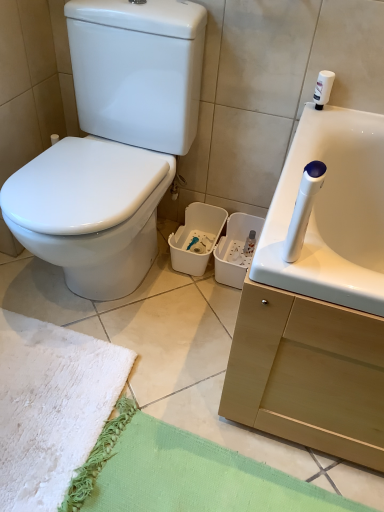
What do you see at coordinates (51, 406) in the screenshot? I see `white fluffy beach towel at lower left` at bounding box center [51, 406].

The height and width of the screenshot is (512, 384). Find the location of `white fluffy beach towel at lower left`. white fluffy beach towel at lower left is located at coordinates (51, 406).

In order to face white glossy toilet at left, should I rotate leftwards or rightwards?

Turn left approximately 11.252 degrees to face it.

Image resolution: width=384 pixels, height=512 pixels. Describe the element at coordinates (113, 144) in the screenshot. I see `white glossy toilet at left` at that location.

Locate an element on the screen. The width and height of the screenshot is (384, 512). white glossy toilet at left is located at coordinates [113, 144].

The height and width of the screenshot is (512, 384). What are the coordinates of `white fluffy beach towel at lower left` in the screenshot? It's located at (51, 406).

Which object is positioned more to the left, white fluffy beach towel at lower left or white glossy toilet at left?

white fluffy beach towel at lower left is more to the left.

From the picture: Considering the relative positions of white fluffy beach towel at lower left and white glossy toilet at left in the image provided, is white fluffy beach towel at lower left in front of white glossy toilet at left?

No, white fluffy beach towel at lower left is behind white glossy toilet at left.

Considering the points (101, 388) and (130, 69), which point is behind, point (101, 388) or point (130, 69)?

The point (130, 69) is farther from the camera.

Based on the photo, from the image's perspective, is white fluffy beach towel at lower left on white glossy toilet at left?

No, from the image's perspective, white fluffy beach towel at lower left is not over white glossy toilet at left.

From a real-world perspective, between white fluffy beach towel at lower left and white glossy toilet at left, who is vertically lower?

white fluffy beach towel at lower left is physically lower.

In the scene shown: Considering the relative sizes of white fluffy beach towel at lower left and white glossy toilet at left in the image provided, is white fluffy beach towel at lower left wider than white glossy toilet at left?

Incorrect, the width of white fluffy beach towel at lower left does not surpass that of white glossy toilet at left.

In the scene shown: Considering the sizes of white fluffy beach towel at lower left and white glossy toilet at left in the image, is white fluffy beach towel at lower left taller or shorter than white glossy toilet at left?

Clearly, white fluffy beach towel at lower left is shorter compared to white glossy toilet at left.

Can you confirm if white fluffy beach towel at lower left is bigger than white glossy toilet at left?

Actually, white fluffy beach towel at lower left might be smaller than white glossy toilet at left.

Can white glossy toilet at left be found inside white fluffy beach towel at lower left?

No, white glossy toilet at left is not surrounded by white fluffy beach towel at lower left.

Based on the photo, is white fluffy beach towel at lower left with white glossy toilet at left?

There is a gap between white fluffy beach towel at lower left and white glossy toilet at left.

Could you tell me if white fluffy beach towel at lower left is turned towards white glossy toilet at left?

No, white fluffy beach towel at lower left is not turned towards white glossy toilet at left.

How distant is white fluffy beach towel at lower left from white glossy toilet at left?

white fluffy beach towel at lower left is 47.10 centimeters from white glossy toilet at left.

At what (x,y) coordinates should I click in order to perform the action: click on beach towel to the left of white glossy toilet at left. Please return your answer as a coordinate pair (x, y). This screenshot has width=384, height=512. Looking at the image, I should click on (51, 406).

Between white glossy toilet at left and white fluffy beach towel at lower left, which one appears on the left side from the viewer's perspective?

white fluffy beach towel at lower left.

Which object is further away from the camera taking this photo, white glossy toilet at left or white fluffy beach towel at lower left?

Positioned behind is white fluffy beach towel at lower left.

Between point (113, 130) and point (66, 362), which one is positioned in front?

Point (66, 362)

From the image's perspective, between white glossy toilet at left and white fluffy beach towel at lower left, who is located below?

white fluffy beach towel at lower left appears lower in the image.

From a real-world perspective, relative to white fluffy beach towel at lower left, is white glossy toilet at left vertically above or below?

From a real-world perspective, white glossy toilet at left is physically above white fluffy beach towel at lower left.

Between white glossy toilet at left and white fluffy beach towel at lower left, which one has larger width?

white glossy toilet at left is wider.

Who is shorter, white glossy toilet at left or white fluffy beach towel at lower left?

With less height is white fluffy beach towel at lower left.

Is white glossy toilet at left bigger than white fluffy beach towel at lower left?

Yes, white glossy toilet at left is bigger than white fluffy beach towel at lower left.

Would you say white glossy toilet at left is inside or outside white fluffy beach towel at lower left?

white glossy toilet at left is spatially situated outside white fluffy beach towel at lower left.

Is white glossy toilet at left placed right next to white fluffy beach towel at lower left?

white glossy toilet at left and white fluffy beach towel at lower left are not in contact.

Does white glossy toilet at left turn towards white fluffy beach towel at lower left?

Yes, white glossy toilet at left is aimed at white fluffy beach towel at lower left.

Can you tell me how much white glossy toilet at left and white fluffy beach towel at lower left differ in facing direction?

The angular difference between white glossy toilet at left and white fluffy beach towel at lower left is 90.5 degrees.

Measure the distance between white glossy toilet at left and white fluffy beach towel at lower left.

A distance of 18.54 inches exists between white glossy toilet at left and white fluffy beach towel at lower left.

Where is `beach towel below the white glossy toilet at left (from the image's perspective)`? beach towel below the white glossy toilet at left (from the image's perspective) is located at coordinates (51, 406).

Where is `toilet lying on the right of white fluffy beach towel at lower left`? toilet lying on the right of white fluffy beach towel at lower left is located at coordinates (113, 144).

At what (x,y) coordinates should I click in order to perform the action: click on toilet positioned vertically above the white fluffy beach towel at lower left (from a real-world perspective). Please return your answer as a coordinate pair (x, y). Image resolution: width=384 pixels, height=512 pixels. Looking at the image, I should click on (113, 144).